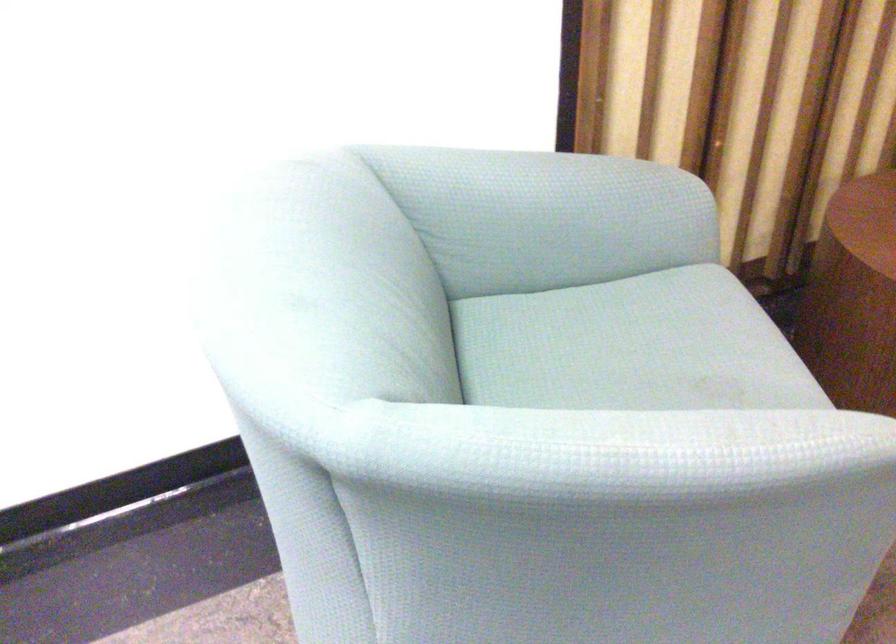
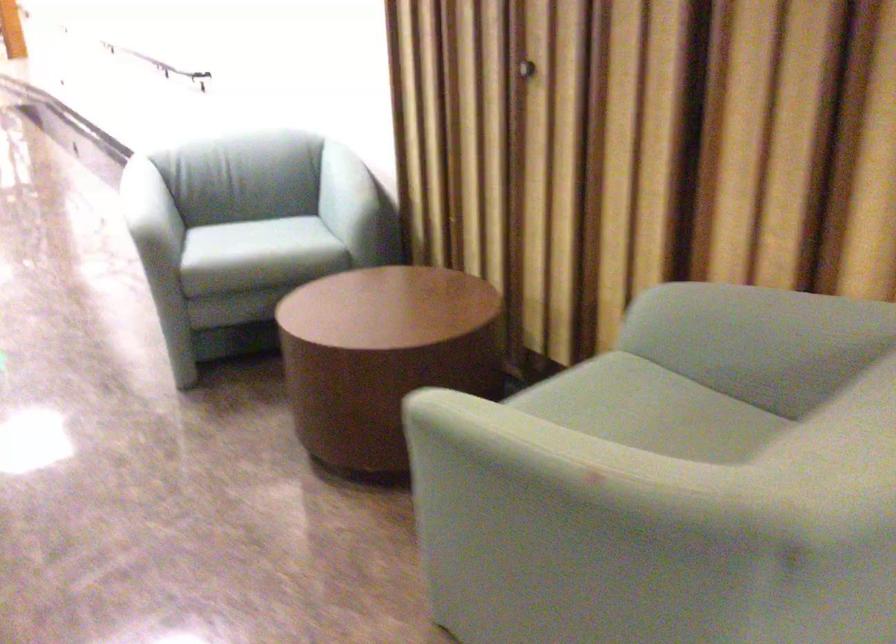
Find the pixel in the second image that matches (x=609, y=202) in the first image.

(346, 191)